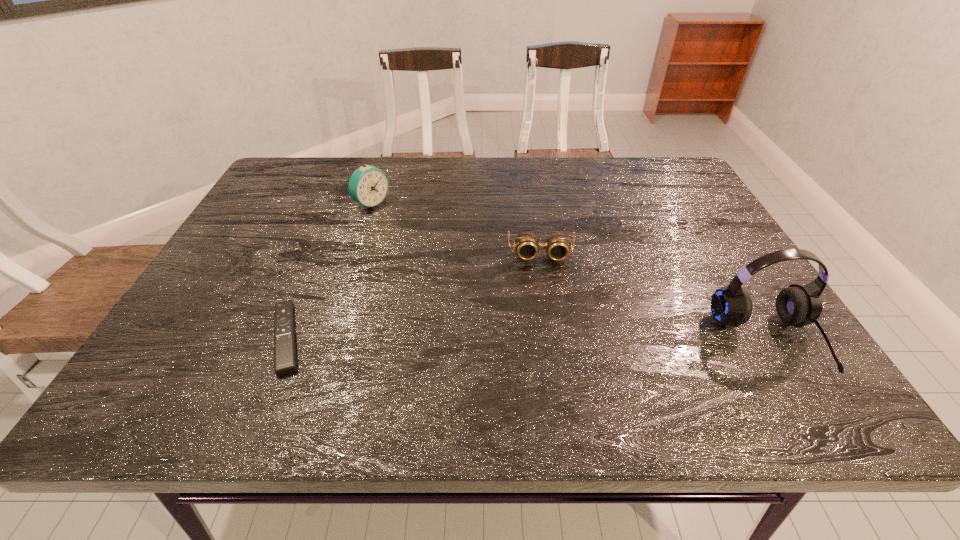
This screenshot has height=540, width=960. Find the location of `vacant space that's between the third tallest object and the headset`. vacant space that's between the third tallest object and the headset is located at coordinates (655, 298).

Identify the location of vacant space that's between the second farthest object and the rightmost object. The width and height of the screenshot is (960, 540). (655, 298).

Where is `vacant space in between the tallest object and the farthest object`? This screenshot has width=960, height=540. vacant space in between the tallest object and the farthest object is located at coordinates (570, 272).

In order to click on the second closest object relative to the headset in this screenshot , I will do `click(368, 185)`.

Locate an element on the screen. The width and height of the screenshot is (960, 540). the third closest object to the farthest object is located at coordinates (796, 305).

The image size is (960, 540). I want to click on free space that satisfies the following two spatial constraints: 1. on the front side of the third nearest object; 2. on the right side of the farthest object, so click(356, 254).